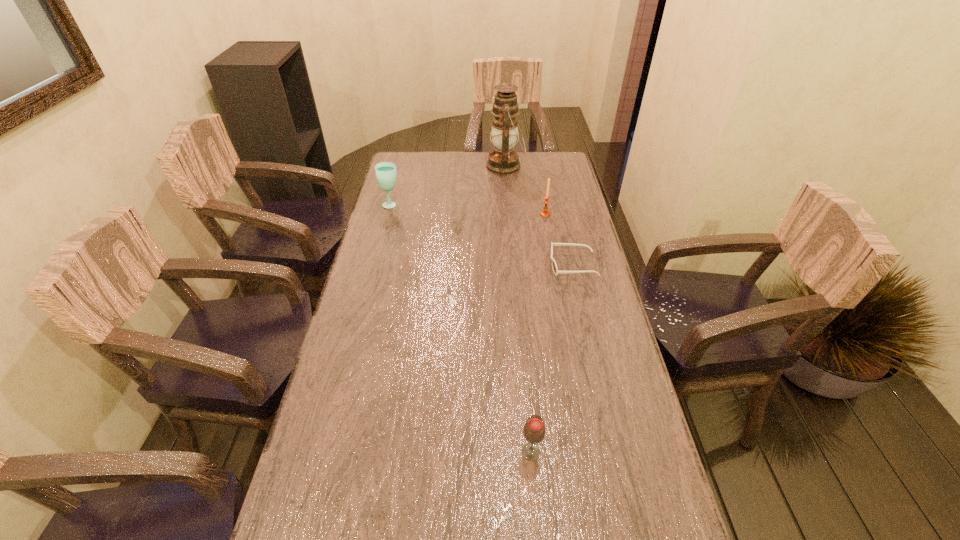
Locate an element on the screen. free space located on the right of the left glass drink container is located at coordinates (501, 204).

The image size is (960, 540). I want to click on vacant space located 0.370m on the left of the candle_holder, so click(442, 214).

At what (x,y) coordinates should I click in order to perform the action: click on free point located 0.380m on the left of the nearest object. Please return your answer as a coordinate pair (x, y). The image size is (960, 540). Looking at the image, I should click on (352, 451).

Where is `free spot located with the lenses of the second nearest object facing outward`? This screenshot has height=540, width=960. free spot located with the lenses of the second nearest object facing outward is located at coordinates (465, 265).

The width and height of the screenshot is (960, 540). What are the coordinates of `vacant space situated with the lenses of the second nearest object facing outward` in the screenshot? It's located at (435, 265).

Locate an element on the screen. Image resolution: width=960 pixels, height=540 pixels. vacant space situated 0.140m with the lenses of the second nearest object facing outward is located at coordinates (508, 265).

You are a GUI agent. You are given a task and a screenshot of the screen. Output one action in this format:
    pyautogui.click(x=<x>, y=<y>)
    Task: Click on the object that is at the far edge
    This screenshot has width=960, height=540.
    Given the screenshot: What is the action you would take?
    pyautogui.click(x=502, y=160)

Where is `object that is at the left edge`? object that is at the left edge is located at coordinates (386, 176).

Where is `candle_holder present at the right edge`? The height and width of the screenshot is (540, 960). candle_holder present at the right edge is located at coordinates (544, 213).

The height and width of the screenshot is (540, 960). I want to click on sunglasses positioned at the right edge, so click(554, 266).